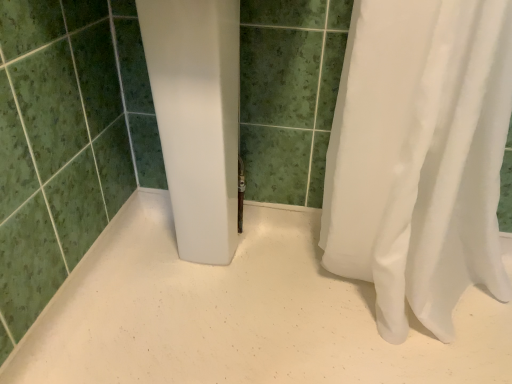
Question: Would you consider white matte shower curtain at right to be distant from green matte tile at center?

Choices:
 (A) yes
 (B) no

Answer: (B)

Question: Is white matte shower curtain at right facing towards green matte tile at center?

Choices:
 (A) no
 (B) yes

Answer: (B)

Question: From a real-world perspective, is white matte shower curtain at right physically above green matte tile at center?

Choices:
 (A) no
 (B) yes

Answer: (A)

Question: Can you confirm if white matte shower curtain at right is wider than green matte tile at center?

Choices:
 (A) no
 (B) yes

Answer: (B)

Question: Does white matte shower curtain at right come in front of green matte tile at center?

Choices:
 (A) no
 (B) yes

Answer: (A)

Question: From the image's perspective, does white matte shower curtain at right appear higher than green matte tile at center?

Choices:
 (A) yes
 (B) no

Answer: (B)

Question: From the image's perspective, would you say green matte tile at center is shown under white matte shower curtain at right?

Choices:
 (A) yes
 (B) no

Answer: (B)

Question: Can you confirm if green matte tile at center is smaller than white matte shower curtain at right?

Choices:
 (A) yes
 (B) no

Answer: (B)

Question: From the image's perspective, is green matte tile at center on white matte shower curtain at right?

Choices:
 (A) no
 (B) yes

Answer: (B)

Question: Is white matte shower curtain at right inside green matte tile at center?

Choices:
 (A) yes
 (B) no

Answer: (B)

Question: Does green matte tile at center lie behind white matte shower curtain at right?

Choices:
 (A) yes
 (B) no

Answer: (B)

Question: Is green matte tile at center taller than white matte shower curtain at right?

Choices:
 (A) yes
 (B) no

Answer: (A)

Question: Is white matte shower curtain at right taller or shorter than green matte tile at center?

Choices:
 (A) short
 (B) tall

Answer: (A)